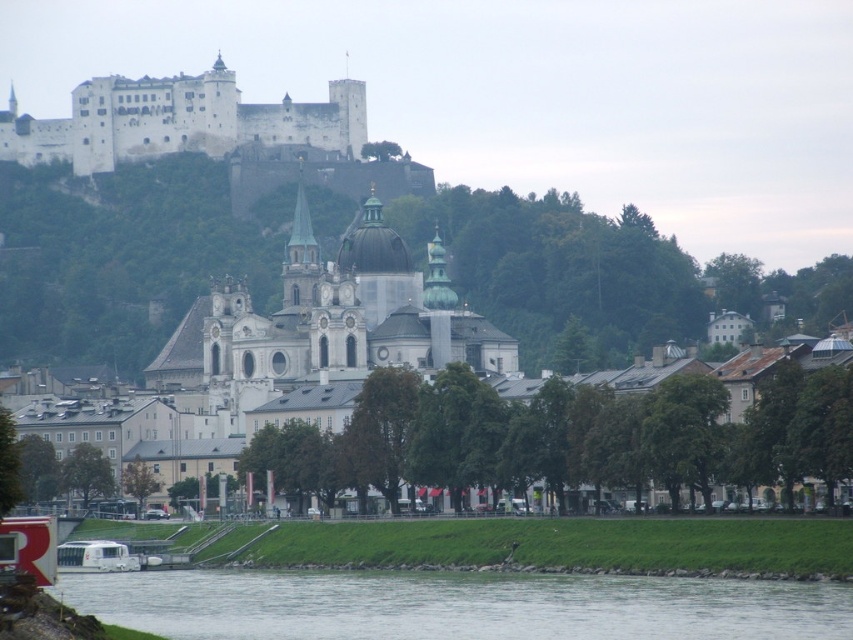
You are a tourist in Salzburg and want to take a photo of the clear water at lower center and the white stone castle at upper left. Which object should you focus on first if you want to capture both in one frame without moving the camera?

You should focus on the white stone castle at upper left first because it is larger than the clear water at lower center, allowing you to frame it properly while still including the smaller clear water at lower center in the shot.

You are standing at the point marked by point (457, 605) in the image, which is located at the lower center. You want to walk towards the grand white church with two spires in the midground. Is the path directly in front of you clear of obstacles?

The clear water at lower center is represented by point (457, 605), so the path directly in front of you is clear of obstacles as it is over the water.